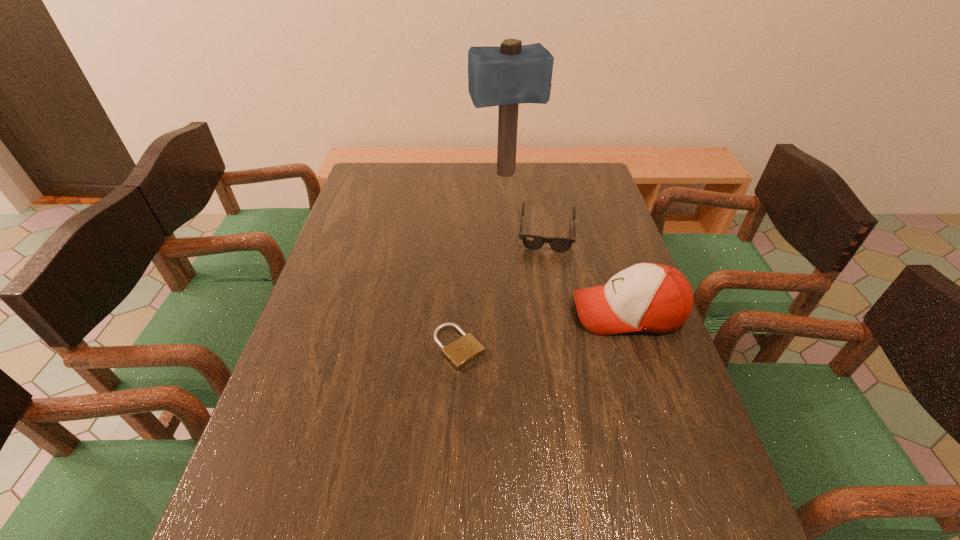
Where is `padlock`? The width and height of the screenshot is (960, 540). padlock is located at coordinates (461, 352).

Locate an element on the screen. the third shortest object is located at coordinates (649, 297).

Where is `the farthest object`? The image size is (960, 540). the farthest object is located at coordinates (506, 76).

This screenshot has height=540, width=960. Identify the location of mallet. (506, 76).

Locate an element on the screen. This screenshot has height=540, width=960. sunglasses is located at coordinates (534, 242).

The height and width of the screenshot is (540, 960). What are the coordinates of `the second shortest object` in the screenshot? It's located at (534, 242).

Find the location of `free space located on the left of the shortest object`. free space located on the left of the shortest object is located at coordinates (412, 347).

This screenshot has height=540, width=960. I want to click on vacant space located 0.150m on the front-facing side of the second tallest object, so click(x=514, y=312).

You are a GUI agent. You are given a task and a screenshot of the screen. Output one action in this format:
    pyautogui.click(x=<x>, y=<y>)
    Task: Click on the vacant space located 0.300m on the front-facing side of the second tallest object
    The width and height of the screenshot is (960, 540).
    Given the screenshot: What is the action you would take?
    pyautogui.click(x=456, y=312)

Locate an element on the screen. The width and height of the screenshot is (960, 540). vacant space located on the front-facing side of the second tallest object is located at coordinates (420, 312).